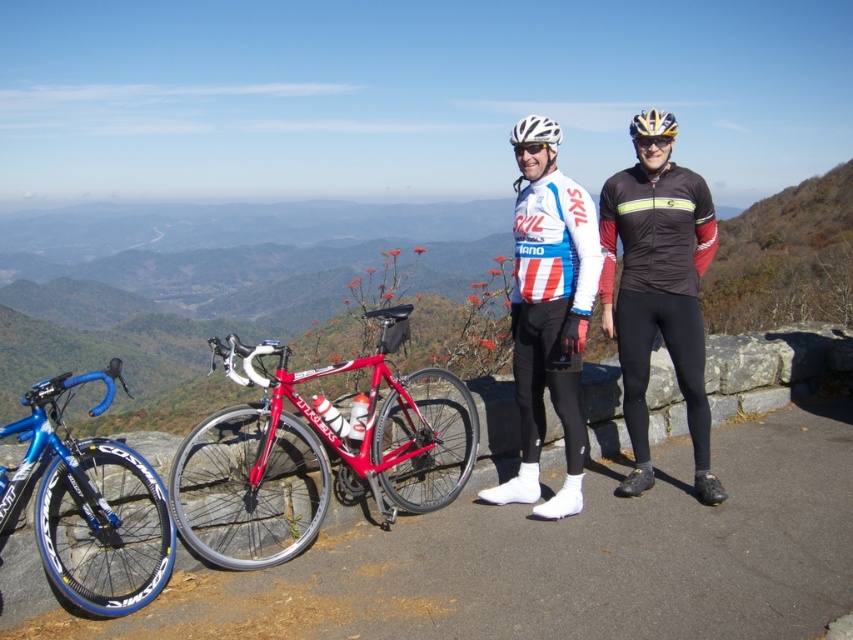
Question: Does black jersey at center come in front of white matte cycling jersey at center?

Choices:
 (A) yes
 (B) no

Answer: (B)

Question: From the image, what is the correct spatial relationship of black jersey at center in relation to white matte bicycle helmet at center?

Choices:
 (A) left
 (B) right

Answer: (A)

Question: Among these objects, which one is farthest from the camera?

Choices:
 (A) shiny red bike at center
 (B) black jersey at center
 (C) white matte cycling jersey at center

Answer: (B)

Question: Does black jersey at center appear on the right side of white matte helmet at center?

Choices:
 (A) yes
 (B) no

Answer: (A)

Question: Which point appears closest to the camera in this image?

Choices:
 (A) (691, 188)
 (B) (531, 173)
 (C) (647, 120)

Answer: (B)

Question: Which point is farther to the camera?

Choices:
 (A) white matte cycling jersey at center
 (B) shiny red bike at center

Answer: (A)